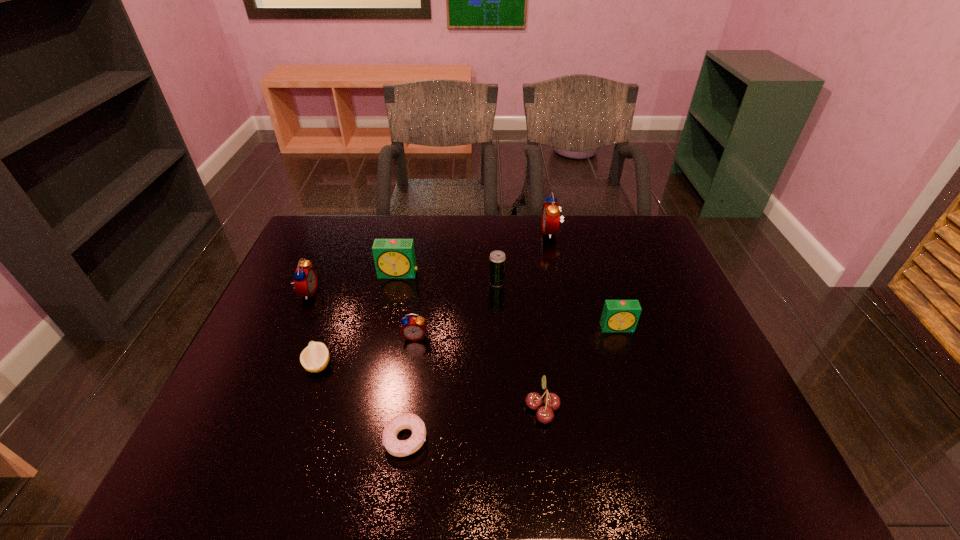
At what (x,y) coordinates should I click in order to perform the action: click on the nearer green alarm clock. Please return your answer as a coordinate pair (x, y). The image size is (960, 540). Looking at the image, I should click on (618, 315).

Locate an element on the screen. the seventh object from left to right is located at coordinates (544, 414).

Find the location of a particular element. The image size is (960, 540). red cherry is located at coordinates (544, 414).

The width and height of the screenshot is (960, 540). I want to click on lemon, so click(x=314, y=358).

I want to click on yellow lemon, so click(x=314, y=358).

Identify the location of white doughnut. This screenshot has width=960, height=540. (399, 448).

Find the location of `vacant space located on the front-facing side of the farthest red alarm clock`. vacant space located on the front-facing side of the farthest red alarm clock is located at coordinates (484, 232).

Locate an element on the screen. The image size is (960, 540). vacant space situated 0.260m on the front-facing side of the farthest red alarm clock is located at coordinates (467, 232).

The width and height of the screenshot is (960, 540). Identify the location of free location located on the front-facing side of the farthest red alarm clock. (501, 232).

The image size is (960, 540). What are the coordinates of `free space located 0.110m on the front-facing side of the second nearest red alarm clock` in the screenshot? It's located at (353, 292).